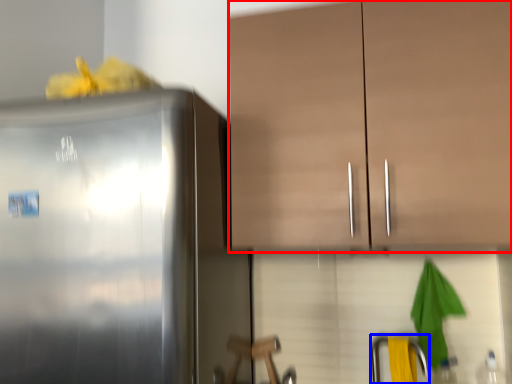
Question: Which point is further to the camera, cabinetry (highlighted by a red box) or faucet (highlighted by a blue box)?

Choices:
 (A) cabinetry
 (B) faucet

Answer: (B)